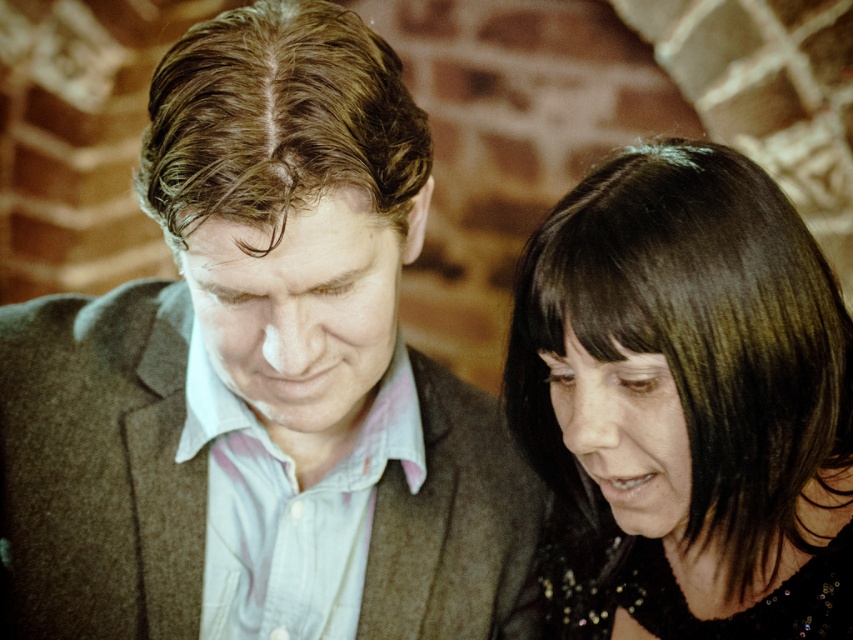
You are a photographer trying to capture a portrait of the two people in the scene. You want to ensure that both the brown woolen suit at center and the shiny black hair at center are clearly visible in the frame. Based on their relative heights, which object should you focus on first to ensure proper depth of field?

The brown woolen suit at center has a greater height compared to shiny black hair at center, so you should focus on the brown woolen suit at center first to ensure both are in focus.

Consider the image. You are a tailor who needs to adjust the brown woolen suit at center so that it doesn t touch the shiny black hair at center. The minimum distance required between them is 10 inches. Based on the current distance, can you proceed with the adjustment as planned?

The current distance between the brown woolen suit at center and the shiny black hair at center is 8.25 inches, which is less than the required 10 inches. Therefore, adjustments are needed to increase the distance between them to meet the requirement.